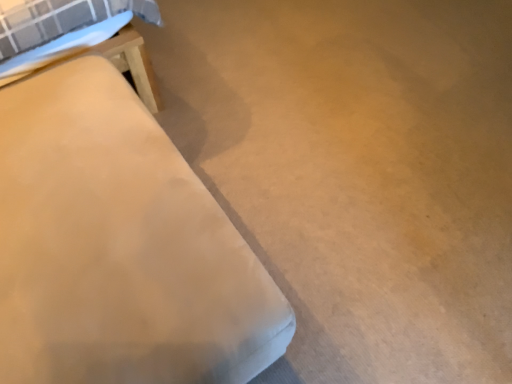
What do you see at coordinates (119, 247) in the screenshot?
I see `beige fabric couch at lower left` at bounding box center [119, 247].

Image resolution: width=512 pixels, height=384 pixels. What are the coordinates of `beige fabric couch at lower left` in the screenshot? It's located at (119, 247).

At what (x,y) coordinates should I click in order to perform the action: click on beige fabric couch at lower left. Please return your answer as a coordinate pair (x, y). Looking at the image, I should click on (119, 247).